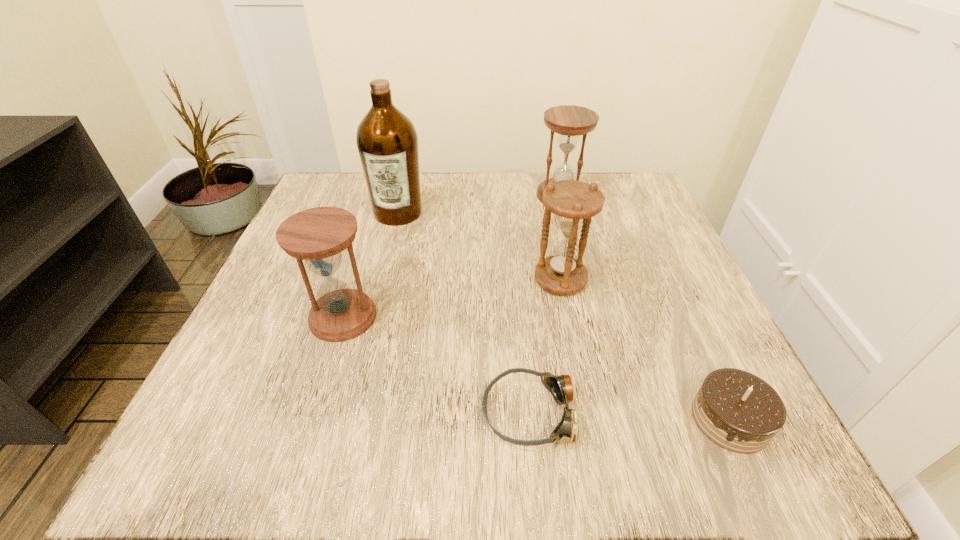
Locate an element on the screen. The height and width of the screenshot is (540, 960). free space located 0.310m through the lenses of the shortest object is located at coordinates (261, 413).

Where is `free space located 0.230m through the lenses of the shortest object`? The image size is (960, 540). free space located 0.230m through the lenses of the shortest object is located at coordinates (319, 413).

What are the coordinates of `vacant space positioned through the lenses of the shortest object` in the screenshot? It's located at pyautogui.click(x=283, y=413).

Where is `olive oil at the far edge`? The width and height of the screenshot is (960, 540). olive oil at the far edge is located at coordinates (387, 141).

Where is `hourglass located at the far edge`? hourglass located at the far edge is located at coordinates (569, 121).

This screenshot has width=960, height=540. In order to click on chocolate cake positioned at the near edge in this screenshot , I will do `click(738, 411)`.

Locate an element on the screen. goggles situated at the near edge is located at coordinates pyautogui.click(x=560, y=386).

Where is `olive oil that is positioned at the left edge`? The height and width of the screenshot is (540, 960). olive oil that is positioned at the left edge is located at coordinates point(387,141).

This screenshot has height=540, width=960. Identify the location of hourglass that is positioned at the left edge. (318, 236).

Where is `hourglass that is at the right edge`? hourglass that is at the right edge is located at coordinates (569, 121).